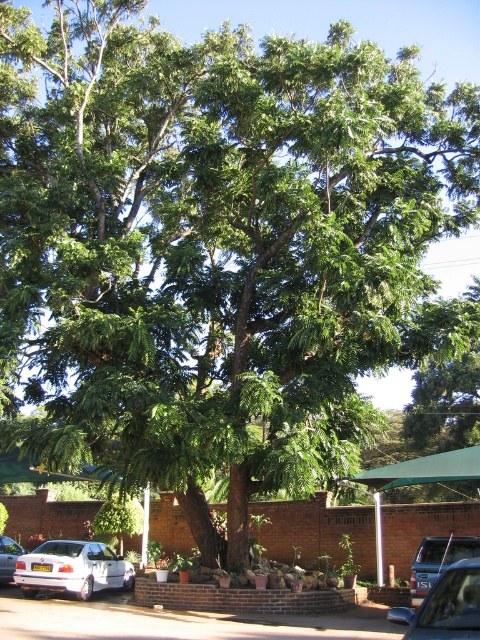
Question: Among these points, which one is farthest from the camera?

Choices:
 (A) [454, 548]
 (B) [49, 557]
 (C) [463, 588]
 (D) [20, 552]

Answer: (D)

Question: Does metallic silver car at lower right come behind metallic gray suv at center?

Choices:
 (A) yes
 (B) no

Answer: (B)

Question: Which of the following is the closest to the observer?

Choices:
 (A) (468, 605)
 (B) (435, 570)
 (C) (91, 548)

Answer: (A)

Question: Which of the following is the farthest from the observer?

Choices:
 (A) (105, 568)
 (B) (447, 556)

Answer: (A)

Question: Can you confirm if white matte sedan at lower left is positioned to the left of white matte car at lower left?

Choices:
 (A) no
 (B) yes

Answer: (A)

Question: Can you confirm if white matte sedan at lower left is positioned to the left of metallic gray suv at center?

Choices:
 (A) no
 (B) yes

Answer: (B)